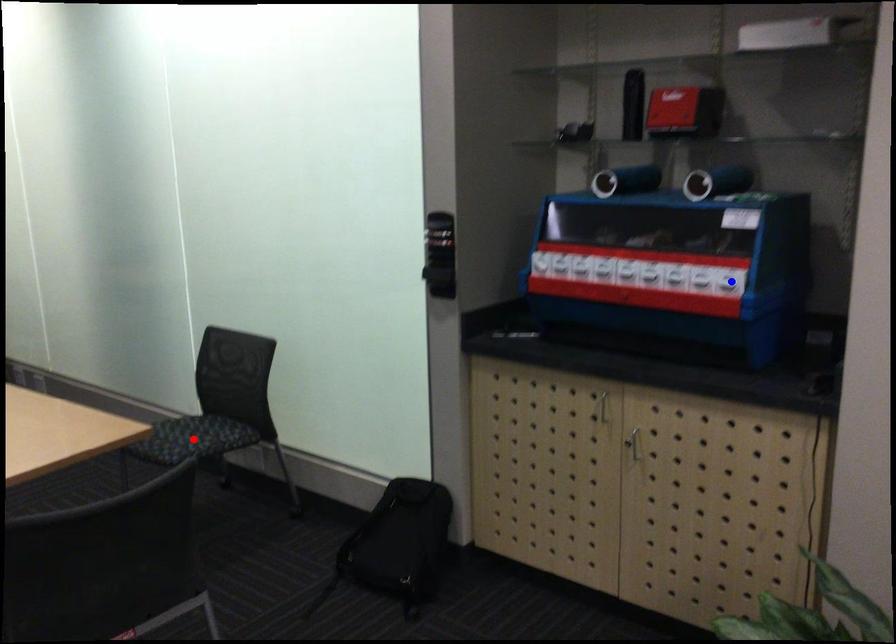
Question: Two points are marked on the image. Which point is closer to the camera?

Choices:
 (A) Blue point is closer.
 (B) Red point is closer.

Answer: (A)